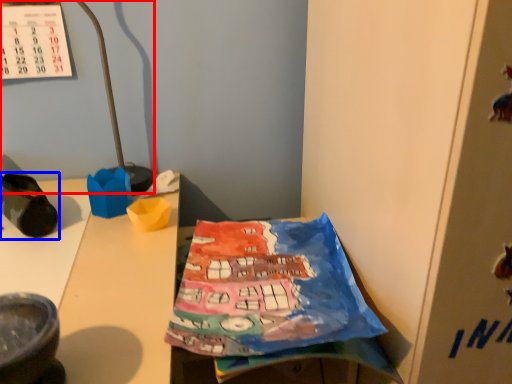
Question: Which point is closer to the camera, lamp (highlighted by a red box) or footwear (highlighted by a blue box)?

Choices:
 (A) lamp
 (B) footwear

Answer: (B)